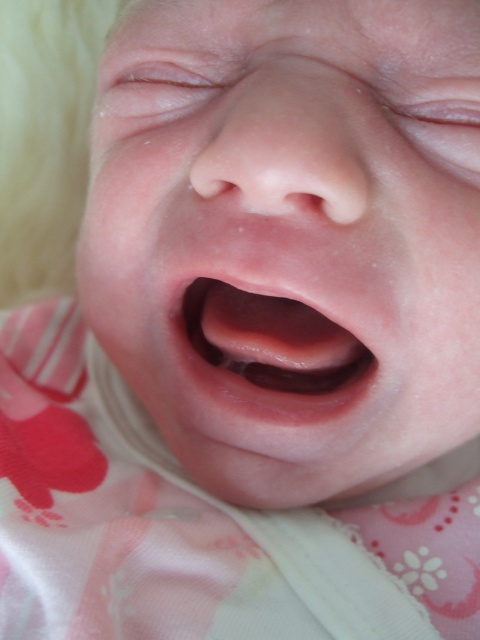
Question: Estimate the real-world distances between objects in this image. Which object is closer to the pink fabric at center?

Choices:
 (A) pink smooth skin at center
 (B) pink smooth flesh at center

Answer: (B)

Question: In this image, where is pink fabric at center located relative to pink smooth flesh at center?

Choices:
 (A) right
 (B) left

Answer: (B)

Question: Is pink fabric at center positioned at the back of pink smooth flesh at center?

Choices:
 (A) no
 (B) yes

Answer: (A)

Question: Among these objects, which one is nearest to the camera?

Choices:
 (A) pink smooth skin at center
 (B) pink fabric at center
 (C) pink smooth flesh at center

Answer: (A)

Question: Can you confirm if pink smooth skin at center is positioned above pink smooth flesh at center?

Choices:
 (A) yes
 (B) no

Answer: (A)

Question: Which object is the closest to the pink smooth skin at center?

Choices:
 (A) pink smooth flesh at center
 (B) pink fabric at center

Answer: (A)